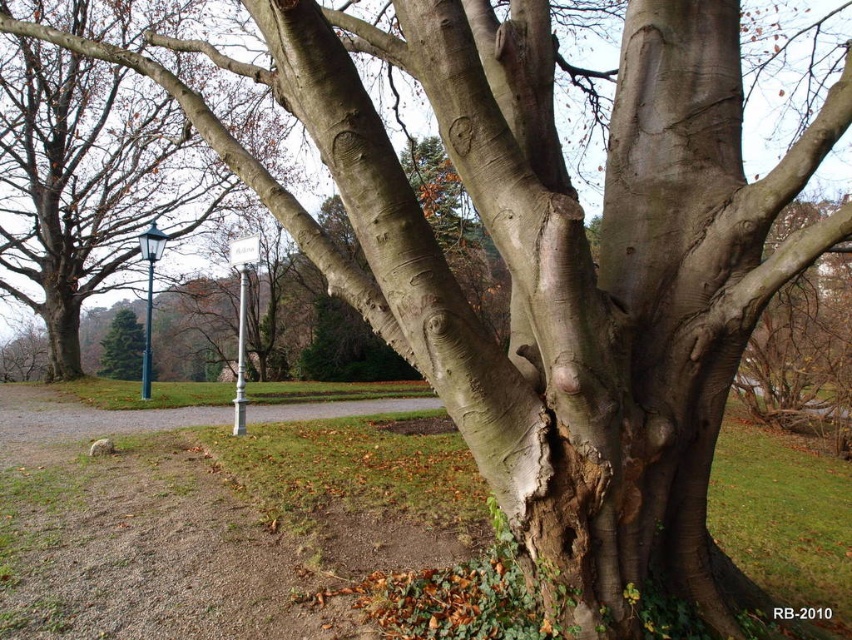
Image resolution: width=852 pixels, height=640 pixels. Describe the element at coordinates (148, 296) in the screenshot. I see `green glass street sign at left` at that location.

Who is more distant from viewer, (148, 323) or (254, 256)?

Point (148, 323)

Locate an element on the screen. green glass street sign at left is located at coordinates (148, 296).

Can you confirm if white metallic street sign at lower left is taller than white plastic sign at upper center?

Correct, white metallic street sign at lower left is much taller as white plastic sign at upper center.

Does white metallic street sign at lower left appear over white plastic sign at upper center?

No.

The image size is (852, 640). Describe the element at coordinates (240, 321) in the screenshot. I see `white metallic street sign at lower left` at that location.

Where is `white metallic street sign at lower left`? The width and height of the screenshot is (852, 640). white metallic street sign at lower left is located at coordinates (240, 321).

Who is taller, smooth gray bark at center or white metallic street sign at lower left?

With more height is white metallic street sign at lower left.

Is smooth gray bark at center taller than white metallic street sign at lower left?

In fact, smooth gray bark at center may be shorter than white metallic street sign at lower left.

Is point (32, 280) less distant than point (240, 296)?

No, (32, 280) is further to viewer.

At what (x,y) coordinates should I click in order to perform the action: click on smooth gray bark at center. Please return your answer as a coordinate pair (x, y). The height and width of the screenshot is (640, 852). Looking at the image, I should click on (89, 180).